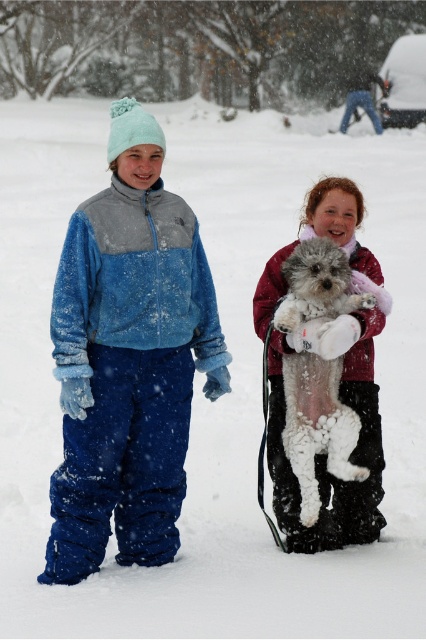
You are a photographer trying to capture both the fuzzy blue snowsuit at left and the white fluffy dog at center in a single frame. Which object should you focus on first to ensure both are in the frame?

The fuzzy blue snowsuit at left is wider than the white fluffy dog at center, so you should focus on the fuzzy blue snowsuit at left first to ensure both fit in the frame.

You are a photographer trying to capture both the fuzzy blue snowsuit at left and the white fluffy dog at center in a single shot. Based on their positions, which one is closer to the camera?

The fuzzy blue snowsuit at left is closer to the camera since it is positioned in front of the white fluffy dog at center.